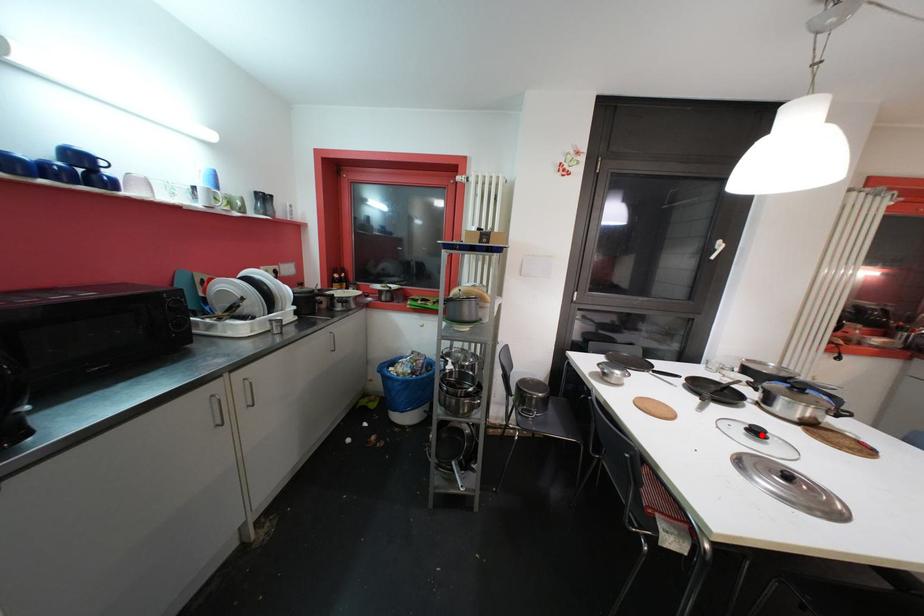
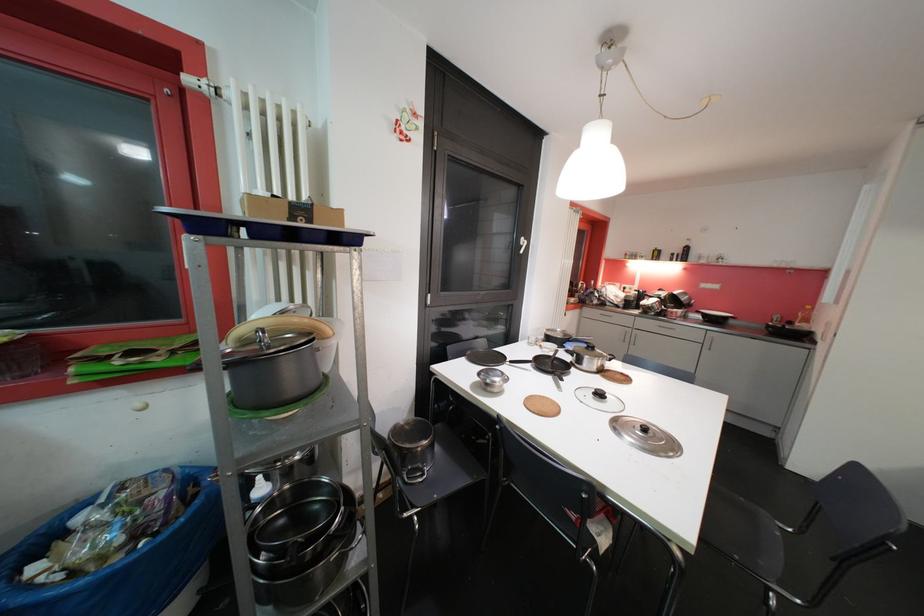
The point at the highlighted location is marked in the first image. Where is the corresponding point in the second image?

(604, 397)